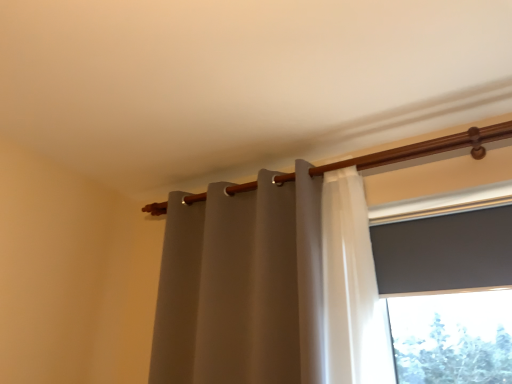
Question: Is matte gray curtain at center beside wooden curtain rod at upper center?

Choices:
 (A) yes
 (B) no

Answer: (B)

Question: Is matte gray curtain at center smaller than wooden curtain rod at upper center?

Choices:
 (A) no
 (B) yes

Answer: (A)

Question: Is matte gray curtain at center completely or partially outside of wooden curtain rod at upper center?

Choices:
 (A) no
 (B) yes

Answer: (B)

Question: Can you confirm if matte gray curtain at center is positioned to the left of wooden curtain rod at upper center?

Choices:
 (A) yes
 (B) no

Answer: (A)

Question: From a real-world perspective, is matte gray curtain at center physically above wooden curtain rod at upper center?

Choices:
 (A) no
 (B) yes

Answer: (A)

Question: From the image's perspective, would you say matte gray curtain at center is shown under wooden curtain rod at upper center?

Choices:
 (A) no
 (B) yes

Answer: (B)

Question: Does wooden curtain rod at upper center appear on the right side of matte gray curtain at center?

Choices:
 (A) no
 (B) yes

Answer: (B)

Question: From a real-world perspective, is wooden curtain rod at upper center positioned under matte gray curtain at center based on gravity?

Choices:
 (A) no
 (B) yes

Answer: (A)

Question: From the image's perspective, does wooden curtain rod at upper center appear higher than matte gray curtain at center?

Choices:
 (A) yes
 (B) no

Answer: (A)

Question: From a real-world perspective, is wooden curtain rod at upper center physically above matte gray curtain at center?

Choices:
 (A) no
 (B) yes

Answer: (B)

Question: Considering the relative sizes of wooden curtain rod at upper center and matte gray curtain at center in the image provided, is wooden curtain rod at upper center wider than matte gray curtain at center?

Choices:
 (A) no
 (B) yes

Answer: (A)

Question: Is matte gray curtain at center surrounded by wooden curtain rod at upper center?

Choices:
 (A) no
 (B) yes

Answer: (A)

Question: From the image's perspective, is wooden curtain rod at upper center on top of matte gray screen at upper right?

Choices:
 (A) no
 (B) yes

Answer: (B)